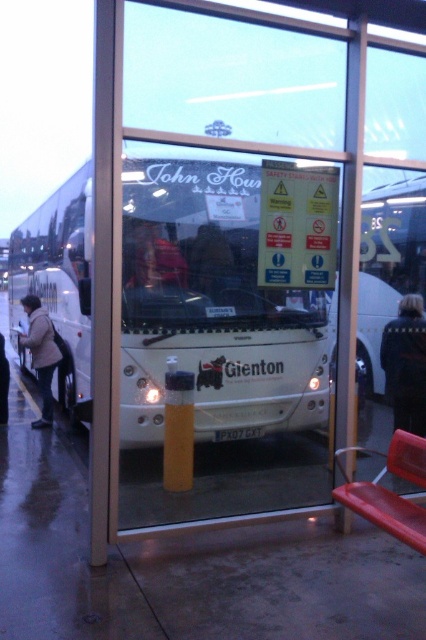
Based on the photo, you are a delivery person trying to load a package onto the white matte bus at center. The package is as wide as the light brown leather jacket at left. Will the package fit inside the bus?

The white matte bus at center has a lesser width compared to light brown leather jacket at left, so the package might not fit inside the bus since the bus is narrower than the jacket.